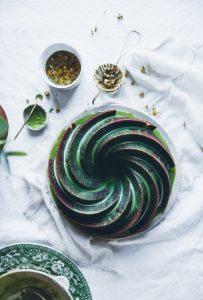
Find the location of a particular element. white plate is located at coordinates (171, 146).